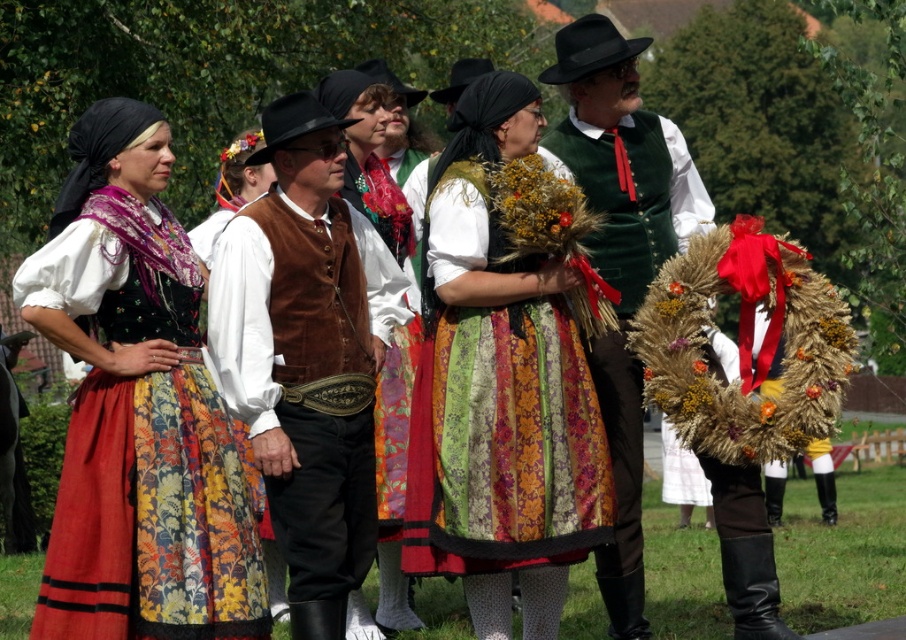
Is matte floral skirt at center further to the viewer compared to multicolored fabric dress at center?

No, matte floral skirt at center is closer to the viewer.

Is point (230, 536) less distant than point (465, 152)?

That is True.

Find the location of a particular element. Image resolution: width=906 pixels, height=640 pixels. matte floral skirt at center is located at coordinates (137, 408).

Is matte floral skirt at center closer to the viewer compared to brown suede vest at center?

That is True.

Which is more to the right, matte floral skirt at center or brown suede vest at center?

Positioned to the right is brown suede vest at center.

What are the coordinates of `matte floral skirt at center` in the screenshot? It's located at (137, 408).

Image resolution: width=906 pixels, height=640 pixels. I want to click on matte floral skirt at center, so click(x=137, y=408).

Between brown suede vest at center and green velvet vest at center, which one appears on the right side from the viewer's perspective?

green velvet vest at center is more to the right.

Does brown suede vest at center have a greater height compared to green velvet vest at center?

Incorrect, brown suede vest at center's height is not larger of green velvet vest at center's.

Identify the location of brown suede vest at center. (307, 355).